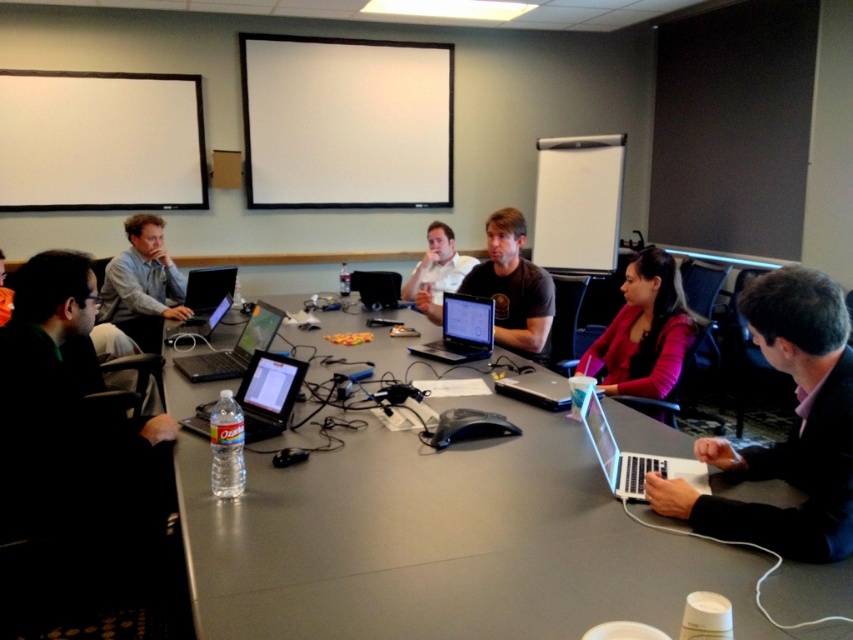
Is gray matte table at center taller than pink matte jacket at center?

No, gray matte table at center is not taller than pink matte jacket at center.

Which is in front, point (537, 490) or point (653, 372)?

Positioned in front is point (537, 490).

Find the location of a particular element. The image size is (853, 640). gray matte table at center is located at coordinates (440, 540).

Between point (677, 276) and point (416, 285), which one is positioned in front?

Point (677, 276) is more forward.

Consider the image. Is pink matte jacket at center to the right of white matte shirt at center from the viewer's perspective?

Yes, pink matte jacket at center is to the right of white matte shirt at center.

What do you see at coordinates (643, 330) in the screenshot?
I see `pink matte jacket at center` at bounding box center [643, 330].

What are the coordinates of `pink matte jacket at center` in the screenshot? It's located at (643, 330).

Is matte gray shirt at left above silver metallic laptop at left?

Yes, matte gray shirt at left is above silver metallic laptop at left.

Can you confirm if matte gray shirt at left is wider than silver metallic laptop at left?

Yes, matte gray shirt at left is wider than silver metallic laptop at left.

Where is `matte gray shirt at left`? The width and height of the screenshot is (853, 640). matte gray shirt at left is located at coordinates (142, 275).